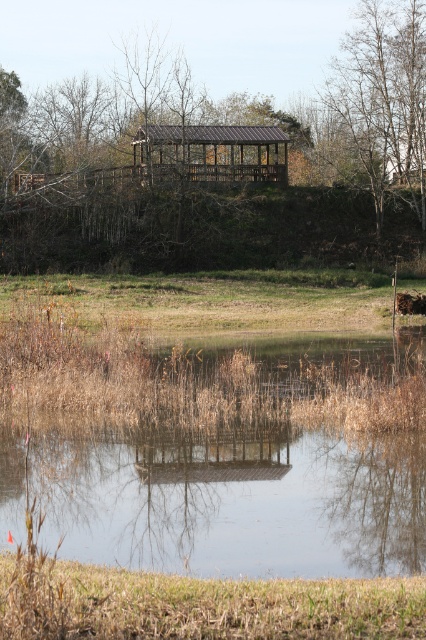
In the scene shown: You are standing at the edge of the transparent glass lake at center and want to reach the brown leafy tree at upper right. Which direction should you walk to get closer to the tree?

You should walk towards the upper right direction to reach the brown leafy tree at upper right as it is located in that direction relative to the transparent glass lake at center.

You are standing at the edge of the water and want to walk towards the brown leafy tree at upper right. Which direction should you head relative to the brown wooden gazebo at upper center?

You should head to the right of the brown wooden gazebo at upper center because the brown leafy tree at upper right is located to the right side of the gazebo.